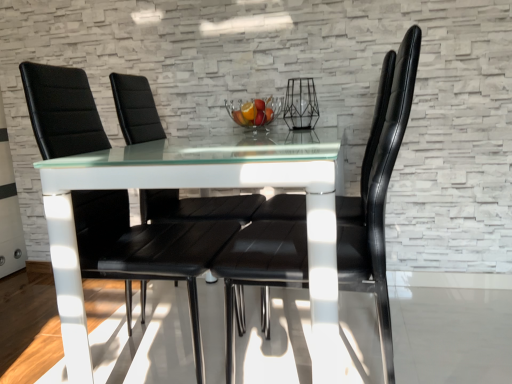
You are a GUI agent. You are given a task and a screenshot of the screen. Output one action in this format:
    pyautogui.click(x=<x>, y=<y>)
    Task: Click on the blank area to the left of black leather chair at center, marked as the 3th chair in a front-to-back arrangement
    Image resolution: width=512 pixels, height=384 pixels.
    Given the screenshot: What is the action you would take?
    (x=106, y=309)